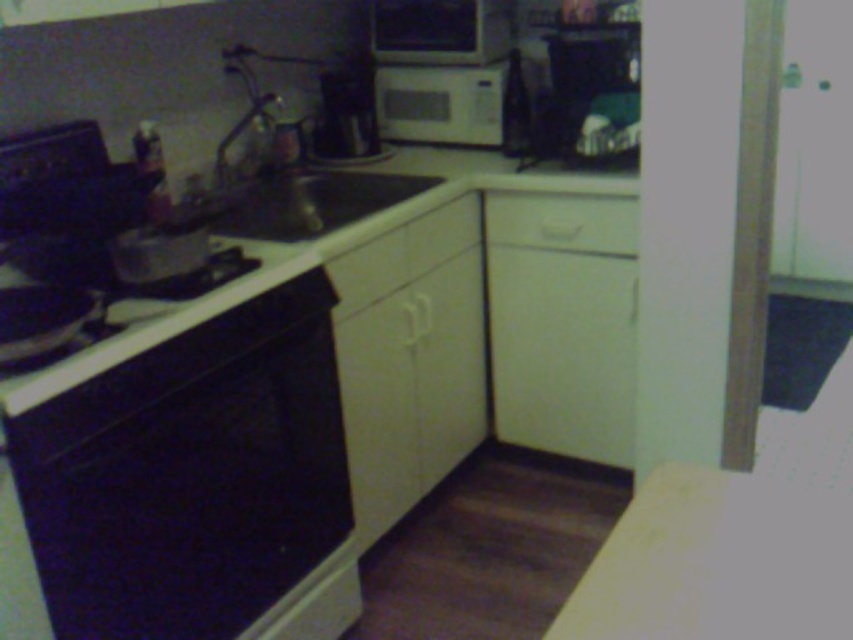
Does white matte counter top at lower right lie in front of white matte microwave at upper center?

Yes.

Which is in front, point (689, 593) or point (474, 120)?

Point (689, 593)

Is point (782, 550) closer to viewer compared to point (450, 140)?

Yes, it is in front of point (450, 140).

Where is `white matte counter top at lower right`? white matte counter top at lower right is located at coordinates (695, 556).

Is point (224, 244) more distant than point (476, 138)?

No, (224, 244) is in front of (476, 138).

I want to click on black glossy stove at lower left, so click(x=158, y=324).

Describe the element at coordinates (158, 324) in the screenshot. The image size is (853, 640). I see `black glossy stove at lower left` at that location.

You are a GUI agent. You are given a task and a screenshot of the screen. Output one action in this format:
    pyautogui.click(x=<x>, y=<y>)
    Task: Click on the black glossy stove at lower left
    The height and width of the screenshot is (640, 853).
    Given the screenshot: What is the action you would take?
    pyautogui.click(x=158, y=324)

Between black glossy oven at lower left and white matte microwave at upper center, which one is positioned higher?

white matte microwave at upper center is above.

Who is shorter, black glossy oven at lower left or white matte microwave at upper center?

Standing shorter between the two is white matte microwave at upper center.

Is point (212, 563) behind point (393, 129)?

No, it is in front of (393, 129).

At what (x,y) coordinates should I click in order to perform the action: click on black glossy oven at lower left. Please return your answer as a coordinate pair (x, y). The width and height of the screenshot is (853, 640). Looking at the image, I should click on (189, 474).